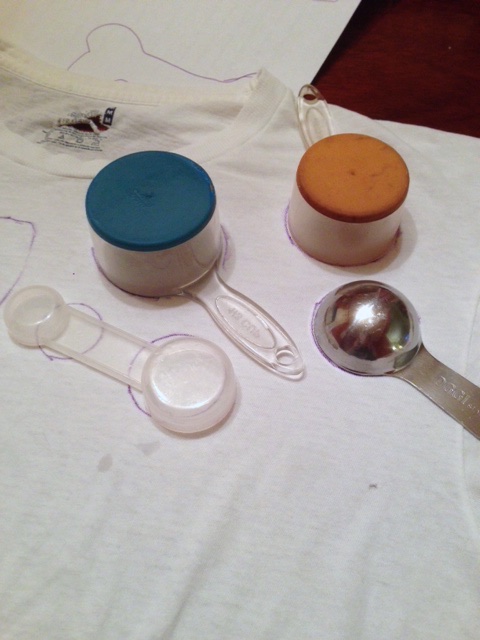
Find the location of a particular element. Image resolution: width=480 pixels, height=640 pixels. measuring cup is located at coordinates (198, 390), (173, 210), (360, 187).